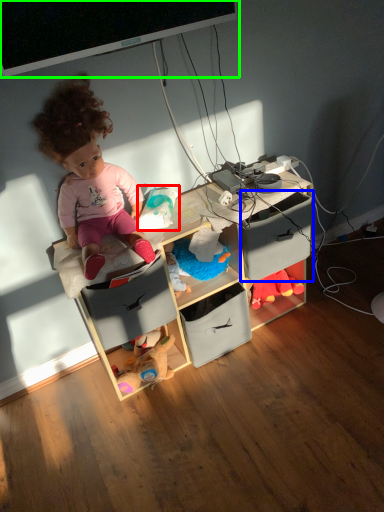
Question: Estimate the real-world distances between objects in this image. Which object is closer to toy (highlighted by a red box), drawer (highlighted by a blue box) or computer monitor (highlighted by a green box)?

Choices:
 (A) drawer
 (B) computer monitor

Answer: (A)